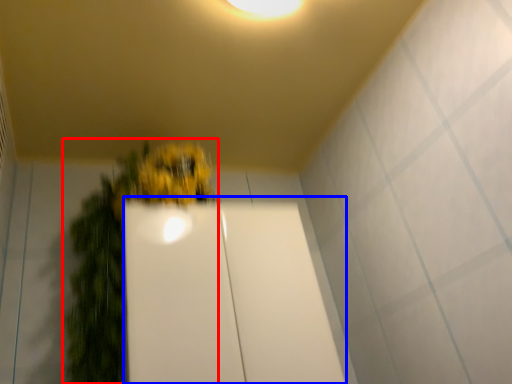
Question: Among these objects, which one is farthest to the camera, houseplant (highlighted by a red box) or glass door (highlighted by a blue box)?

Choices:
 (A) houseplant
 (B) glass door

Answer: (B)